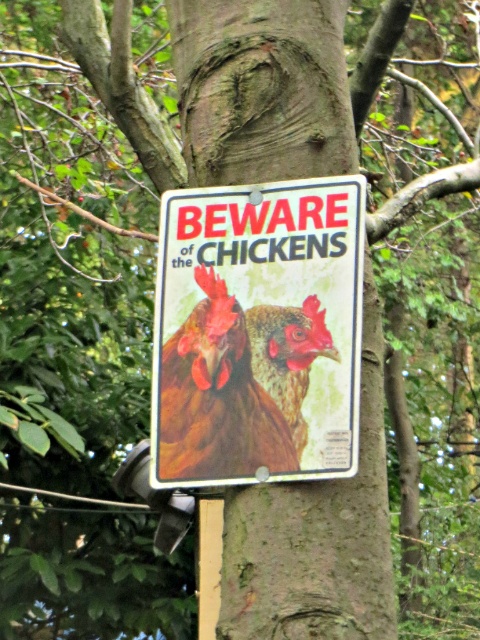
You are a hiker who wants to take a photo of the brown feathered chicken at center without the metallic signboard at center blocking the view. Is the chicken visible in the frame if you position yourself directly behind the signboard?

The metallic signboard at center is wider than the brown feathered chicken at center, so if you position yourself directly behind the signboard, the chicken might still be partially visible depending on the angle and distance. However, since the signboard is wider, it could block part of the chicken. To ensure full visibility, move to the side where the chicken is not obscured by the signboard.

You are a hiker who wants to know which chicken is wider. You see a brown feathered chicken at center and a brown matte chicken at center. Which one is wider?

The brown feathered chicken at center might be wider than brown matte chicken at center.

You are a painter standing 2 feet away from the metallic signboard at center. You want to paint the brown matte chicken at center without moving closer. Can you reach it with your 3.5 feet long paintbrush?

The distance between the metallic signboard at center and the brown matte chicken at center is 3.55 inches. Since you are 2 feet away from the signboard, the total distance to the chicken would be 2 feet plus 3.55 inches. Converting to inches, 2 feet is 24 inches, so total distance is 27.55 inches. Your paintbrush is 3.5 feet long, which is 42 inches. Since 42 inches is longer than 27.55 inches, you can reach the brown matte chicken at center with your paintbrush.